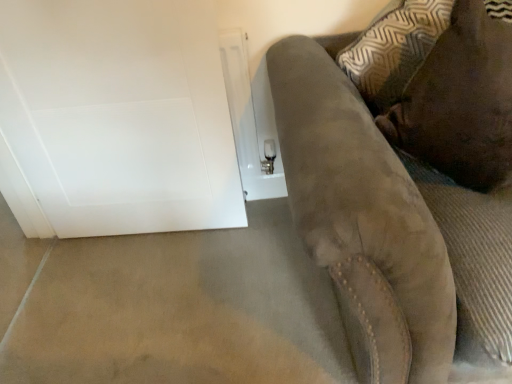
Question: Is suede couch at right at the left side of beige carpet at lower left?

Choices:
 (A) no
 (B) yes

Answer: (A)

Question: From a real-world perspective, is suede couch at right below beige carpet at lower left?

Choices:
 (A) yes
 (B) no

Answer: (B)

Question: From a real-world perspective, is suede couch at right located higher than beige carpet at lower left?

Choices:
 (A) yes
 (B) no

Answer: (A)

Question: Is suede couch at right taller than beige carpet at lower left?

Choices:
 (A) no
 (B) yes

Answer: (B)

Question: Considering the relative positions of suede couch at right and beige carpet at lower left in the image provided, is suede couch at right to the right of beige carpet at lower left from the viewer's perspective?

Choices:
 (A) yes
 (B) no

Answer: (A)

Question: Is brown suede pillow at upper right bigger or smaller than white glossy door at left?

Choices:
 (A) big
 (B) small

Answer: (A)

Question: Is brown suede pillow at upper right in front of or behind white glossy door at left in the image?

Choices:
 (A) behind
 (B) front

Answer: (B)

Question: Considering the positions of brown suede pillow at upper right and white glossy door at left in the image, is brown suede pillow at upper right taller or shorter than white glossy door at left?

Choices:
 (A) tall
 (B) short

Answer: (B)

Question: From a real-world perspective, is brown suede pillow at upper right positioned above or below white glossy door at left?

Choices:
 (A) below
 (B) above

Answer: (B)

Question: Is white glossy door at left spatially inside brown suede pillow at upper right, or outside of it?

Choices:
 (A) inside
 (B) outside

Answer: (B)

Question: Relative to brown suede pillow at upper right, is white glossy door at left in front or behind?

Choices:
 (A) front
 (B) behind

Answer: (B)

Question: Is white glossy door at left bigger or smaller than brown suede pillow at upper right?

Choices:
 (A) big
 (B) small

Answer: (B)

Question: From a real-world perspective, is white glossy door at left physically located above or below brown suede pillow at upper right?

Choices:
 (A) above
 (B) below

Answer: (B)

Question: In the image, is beige carpet at lower left on the left side or the right side of suede couch at right?

Choices:
 (A) right
 (B) left

Answer: (B)

Question: From the image's perspective, is beige carpet at lower left positioned above or below suede couch at right?

Choices:
 (A) above
 (B) below

Answer: (B)